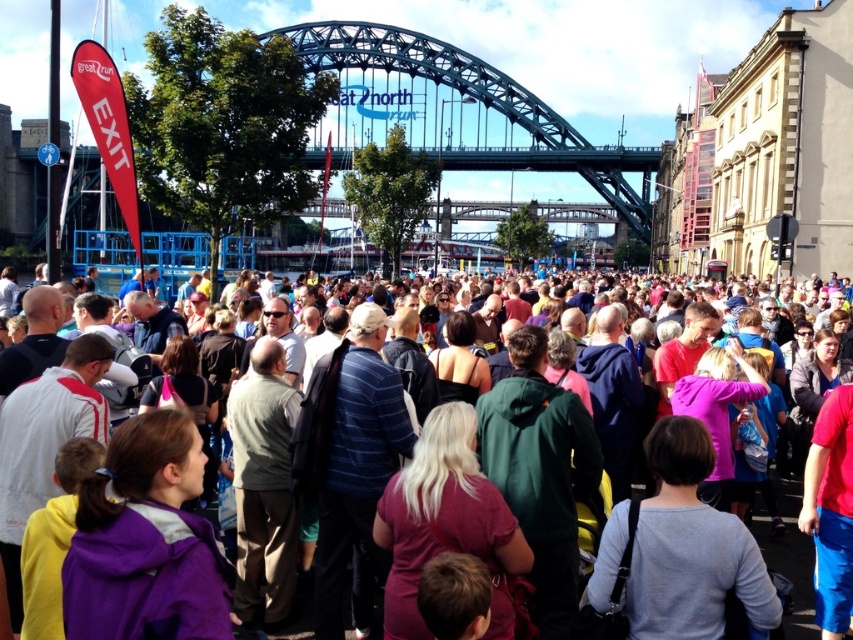
Question: Observing the image, what is the correct spatial positioning of green steel bridge at center in reference to multicolored clothing at center?

Choices:
 (A) left
 (B) right

Answer: (A)

Question: Among these objects, which one is farthest from the camera?

Choices:
 (A) green steel bridge at center
 (B) multicolored clothing at center

Answer: (A)

Question: Which point is closer to the camera taking this photo?

Choices:
 (A) (486, 148)
 (B) (769, 556)

Answer: (B)

Question: Observing the image, what is the correct spatial positioning of green steel bridge at center in reference to multicolored clothing at center?

Choices:
 (A) left
 (B) right

Answer: (A)

Question: Which point is farther to the camera?

Choices:
 (A) (769, 516)
 (B) (646, 189)

Answer: (B)

Question: Is green steel bridge at center to the left of multicolored clothing at center from the viewer's perspective?

Choices:
 (A) no
 (B) yes

Answer: (B)